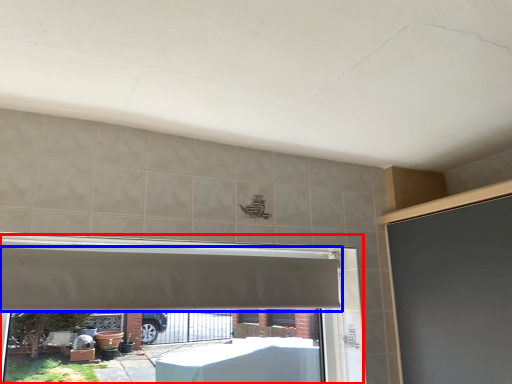
Question: Which object is further to the camera taking this photo, window frame (highlighted by a red box) or exhaust hood (highlighted by a blue box)?

Choices:
 (A) window frame
 (B) exhaust hood

Answer: (B)